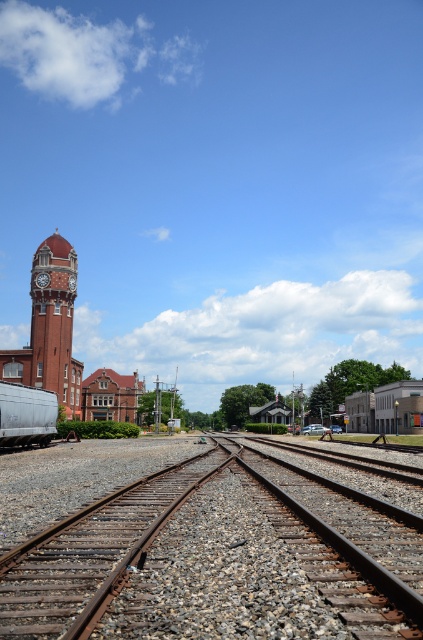
You are standing at the edge of the railway scene and want to take a photo of the silver metallic train car at lower left and the rusty metal train tracks at center. Which object should you focus on first if you want to capture both in the same frame without moving the camera?

You should focus on the silver metallic train car at lower left first because the rusty metal train tracks at center is located below it, so adjusting the camera angle to include both would require framing from the higher position of the train car down to the tracks below.

You are a railway engineer assessing the layout of the tracks and structures. Given the presence of the rusty metal train tracks at center and the matte brick clock tower at left, which object occupies a larger horizontal space in the image?

The rusty metal train tracks at center occupy a larger horizontal space because their width surpasses that of the matte brick clock tower at left.

You are a photographer planning to take a picture of the matte brick clock tower at left and the rusty metal train tracks at center. You want to ensure the clock tower appears to the left of the tracks in the final image. Based on the scene description, will your composition naturally achieve this layout?

Yes, the composition will naturally achieve the layout because the rusty metal train tracks at center is positioned on the right side of the matte brick clock tower at left, meaning the clock tower is already to the left of the tracks in the scene.